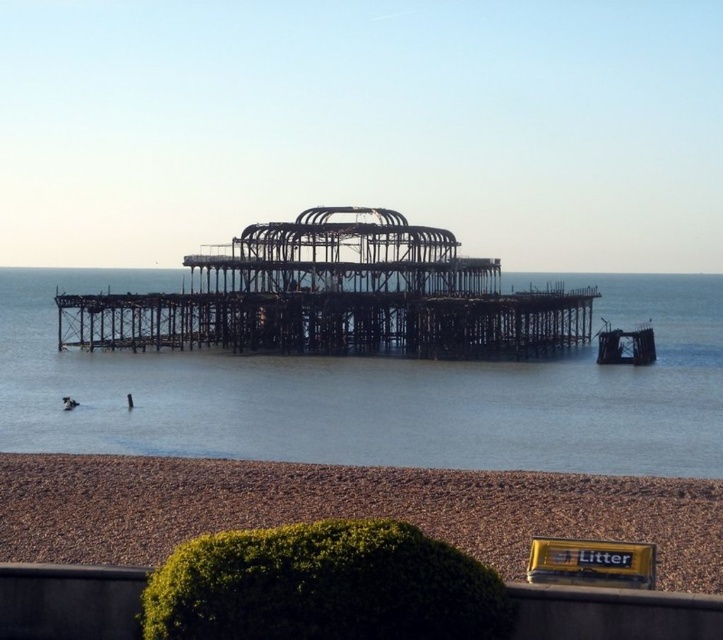
You are standing at the center of the image and want to move to the point marked as point (68, 403). Which direction should you go?

You should move towards the lower left direction to reach point (68, 403) because it is located on the dark blue fabric at lower left.

You are standing on the pebble beach in front of the dilapidated structure. You notice a dark blue fabric at lower left and a dark skin human at lower left. Which object is wider?

The dark blue fabric at lower left is wider than the dark skin human at lower left.